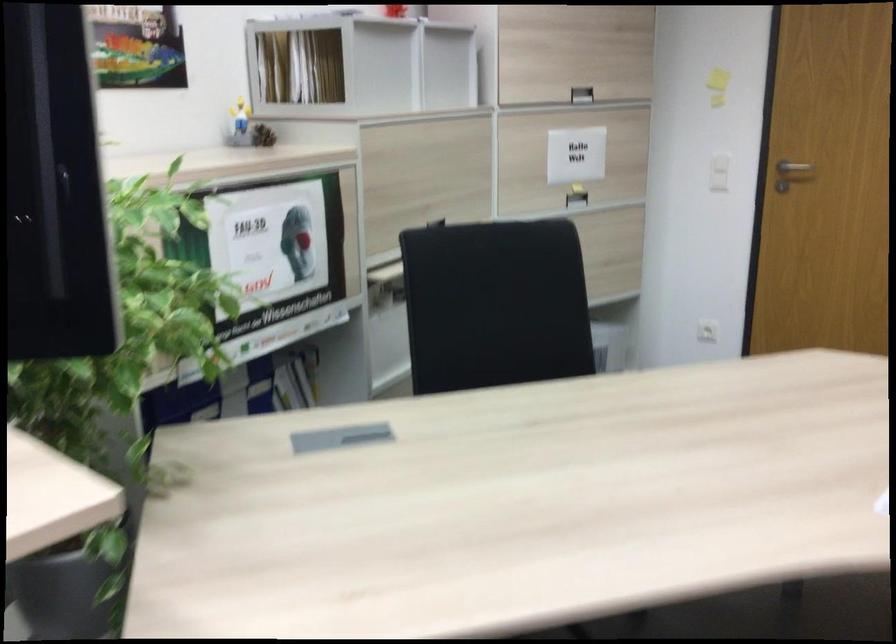
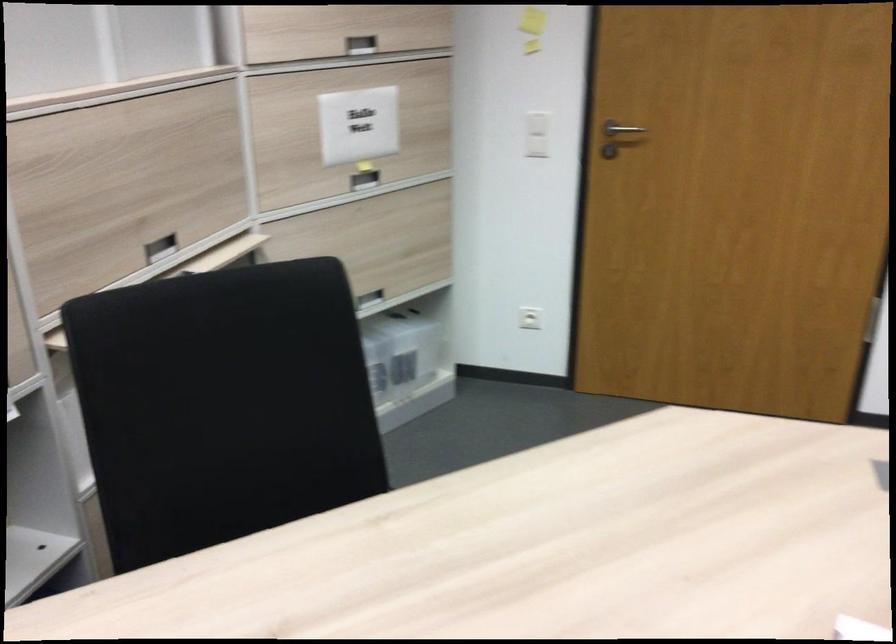
In the second image, find the point that corresponds to [586,91] in the first image.

(360, 44)